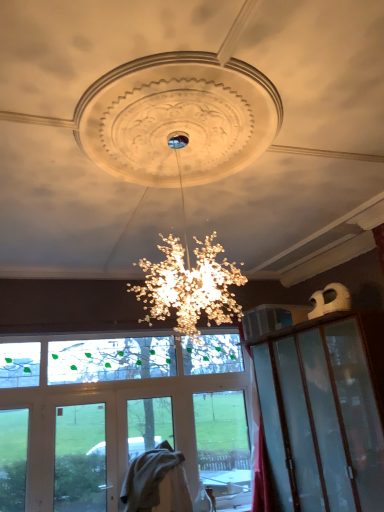
Question: Based on their positions, is transparent glass window screen at center located to the left or right of clear glass door at center?

Choices:
 (A) left
 (B) right

Answer: (B)

Question: From a real-world perspective, relative to clear glass door at center, is transparent glass window screen at center vertically above or below?

Choices:
 (A) above
 (B) below

Answer: (A)

Question: Looking at their shapes, would you say transparent glass window screen at center is wider or thinner than clear glass door at center?

Choices:
 (A) thin
 (B) wide

Answer: (A)

Question: Is clear glass door at center wider or thinner than transparent glass window screen at center?

Choices:
 (A) wide
 (B) thin

Answer: (A)

Question: Is clear glass door at center in front of or behind transparent glass window screen at center in the image?

Choices:
 (A) front
 (B) behind

Answer: (A)

Question: From the image's perspective, relative to transparent glass window screen at center, is clear glass door at center above or below?

Choices:
 (A) above
 (B) below

Answer: (B)

Question: Considering the relative positions of clear glass door at center and transparent glass window screen at center in the image provided, is clear glass door at center to the left or to the right of transparent glass window screen at center?

Choices:
 (A) left
 (B) right

Answer: (A)